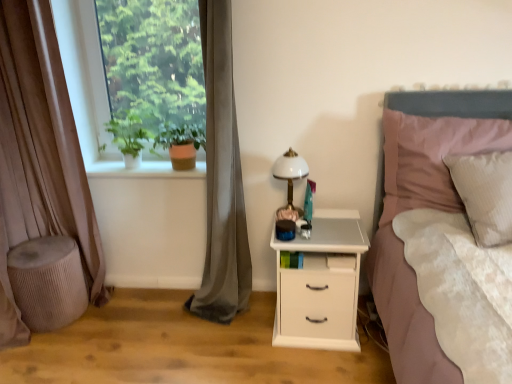
Find the location of `vacant area that lies between brown velvet curtain at left, the 2th curtain when ordered from right to left, and gray velvet curtain at left, the first curtain in the right-to-left sequence`. vacant area that lies between brown velvet curtain at left, the 2th curtain when ordered from right to left, and gray velvet curtain at left, the first curtain in the right-to-left sequence is located at coordinates (146, 303).